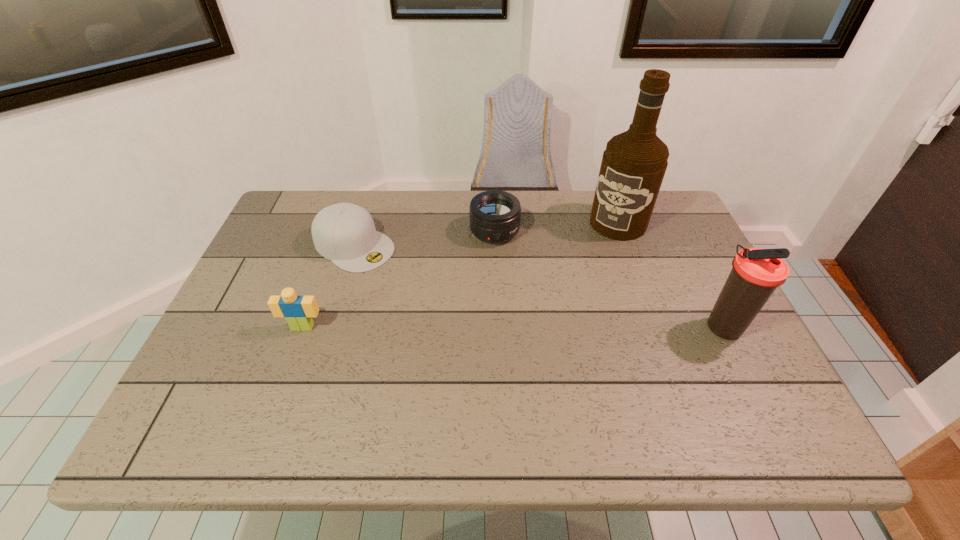
The height and width of the screenshot is (540, 960). Find the location of `the third tallest object`. the third tallest object is located at coordinates (298, 311).

Find the location of a particular element. This screenshot has width=960, height=540. the fourth shortest object is located at coordinates 756,273.

The width and height of the screenshot is (960, 540). I want to click on the rightmost object, so click(756, 273).

Identify the location of cap. (345, 233).

Image resolution: width=960 pixels, height=540 pixels. I want to click on the third object from left to right, so (495, 215).

Locate an element on the screen. the fourth object from left to right is located at coordinates (633, 166).

Identify the location of the tallest object. (633, 166).

Where is `vacant area situated 0.050m on the face of the third tallest object`? vacant area situated 0.050m on the face of the third tallest object is located at coordinates (295, 349).

Find the location of `free spot located on the left of the thermos bottle`. free spot located on the left of the thermos bottle is located at coordinates (558, 327).

Locate an element on the screen. free space located on the front-facing side of the cap is located at coordinates (395, 271).